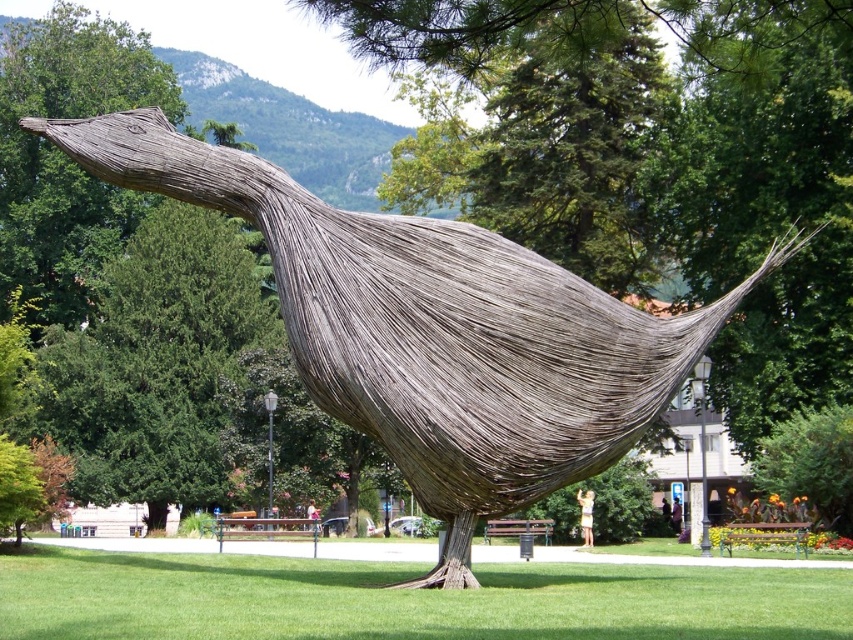
Question: Which of the following is the closest to the observer?

Choices:
 (A) green grass at lower center
 (B) natural wood bird at center
 (C) green textured tree at center

Answer: (A)

Question: Which point appears closest to the camera in this image?

Choices:
 (A) (51, 387)
 (B) (372, 250)
 (C) (343, 609)

Answer: (C)

Question: Which of these objects is positioned farthest from the natural wood bird at center?

Choices:
 (A) green textured tree at center
 (B) green grass at lower center

Answer: (A)

Question: In this image, where is natural wood bird at center located relative to green grass at lower center?

Choices:
 (A) above
 (B) below

Answer: (A)

Question: Observing the image, what is the correct spatial positioning of natural wood bird at center in reference to green textured tree at center?

Choices:
 (A) left
 (B) right

Answer: (B)

Question: Does natural wood bird at center lie in front of green grass at lower center?

Choices:
 (A) yes
 (B) no

Answer: (B)